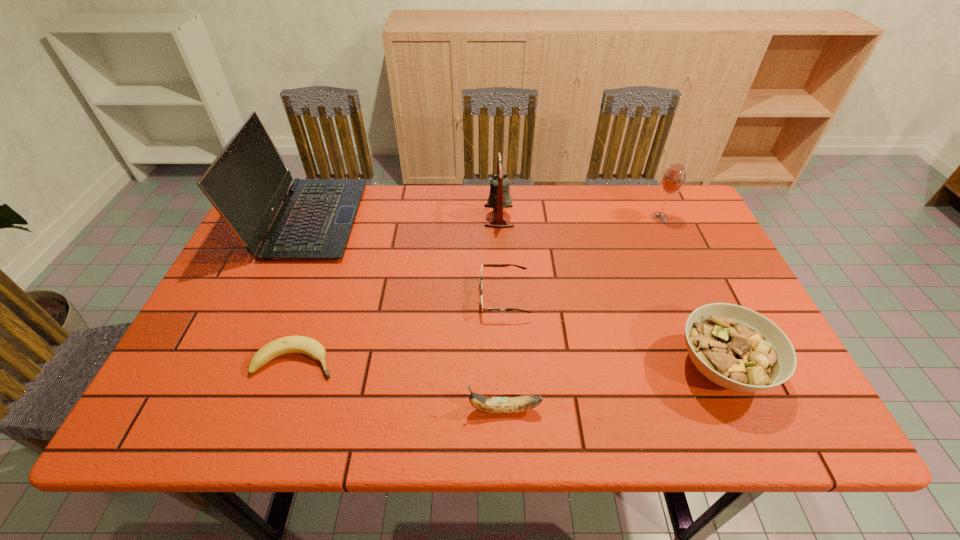
You are a GUI agent. You are given a task and a screenshot of the screen. Output one action in this format:
    pyautogui.click(x=<x>, y=<y>)
    Task: Click on the object located in the far right corner section of the desktop
    The width and height of the screenshot is (960, 540).
    Given the screenshot: What is the action you would take?
    pyautogui.click(x=673, y=179)

Identify the location of object that is at the near right corner. This screenshot has height=540, width=960. (737, 348).

The image size is (960, 540). In the image, there is a desktop. What are the coordinates of `free region at the far edge` in the screenshot? It's located at (475, 225).

You are a GUI agent. You are given a task and a screenshot of the screen. Output one action in this format:
    pyautogui.click(x=<x>, y=<y>)
    Task: Click on the vacant area at the near edge of the desktop
    This screenshot has height=540, width=960.
    Given the screenshot: What is the action you would take?
    pyautogui.click(x=623, y=400)

Locate an element on the screen. The image size is (960, 540). vacant space at the left edge of the desktop is located at coordinates (229, 325).

Where is `free space at the right edge`? This screenshot has width=960, height=540. free space at the right edge is located at coordinates [x=716, y=261].

This screenshot has width=960, height=540. What are the coordinates of `vacant space at the far right corner of the desktop` in the screenshot? It's located at (669, 213).

Where is `vacant space at the near right corner of the desktop`? Image resolution: width=960 pixels, height=540 pixels. vacant space at the near right corner of the desktop is located at coordinates (802, 418).

Where is `free spot between the right banana and the laptop computer`? The height and width of the screenshot is (540, 960). free spot between the right banana and the laptop computer is located at coordinates click(406, 314).

Locate an element on the screen. Image resolution: width=960 pixels, height=540 pixels. vacant space in between the bell and the wineglass is located at coordinates (579, 217).